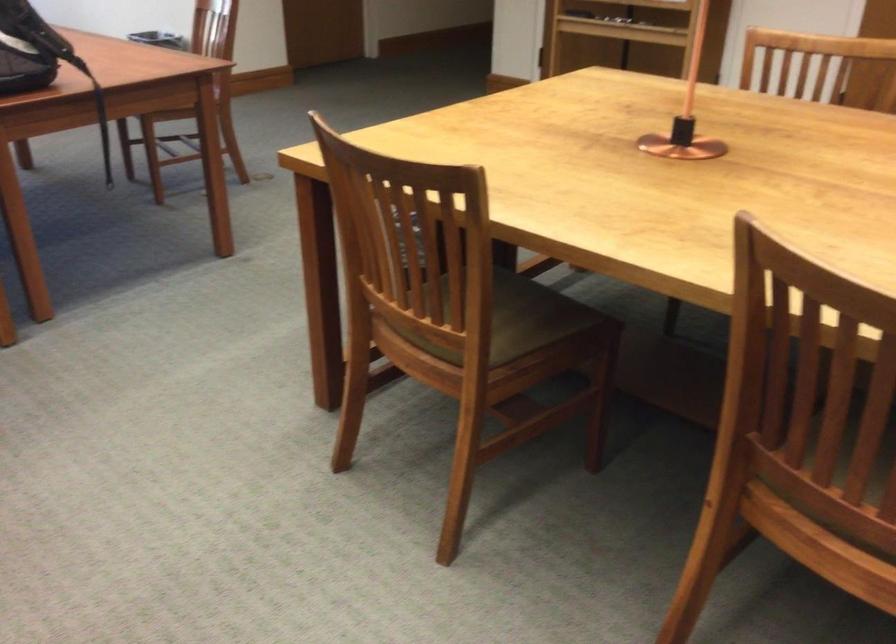
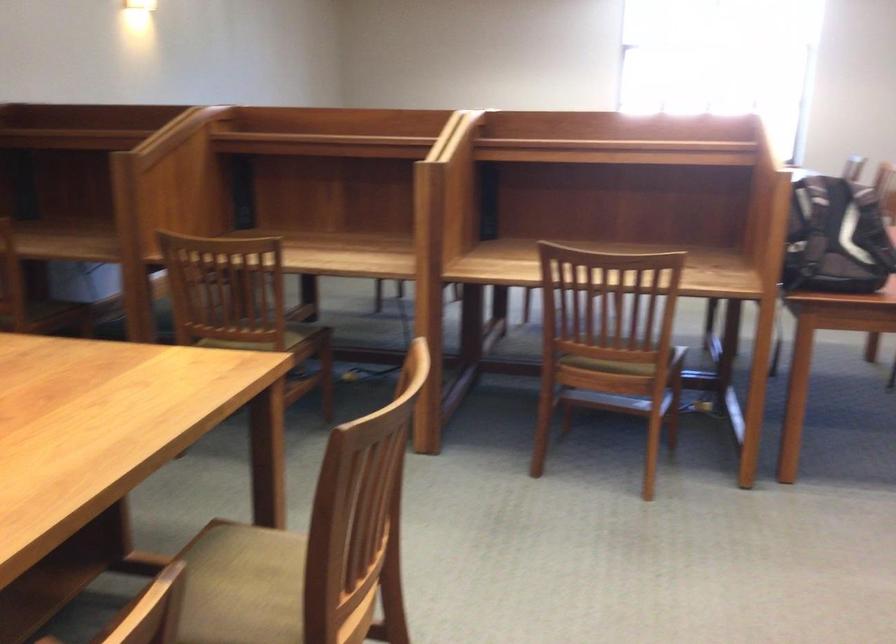
Question: The images are taken continuously from a first-person perspective. In which direction is your viewpoint rotating?

Choices:
 (A) Left
 (B) Right
 (C) Up
 (D) Down

Answer: (A)